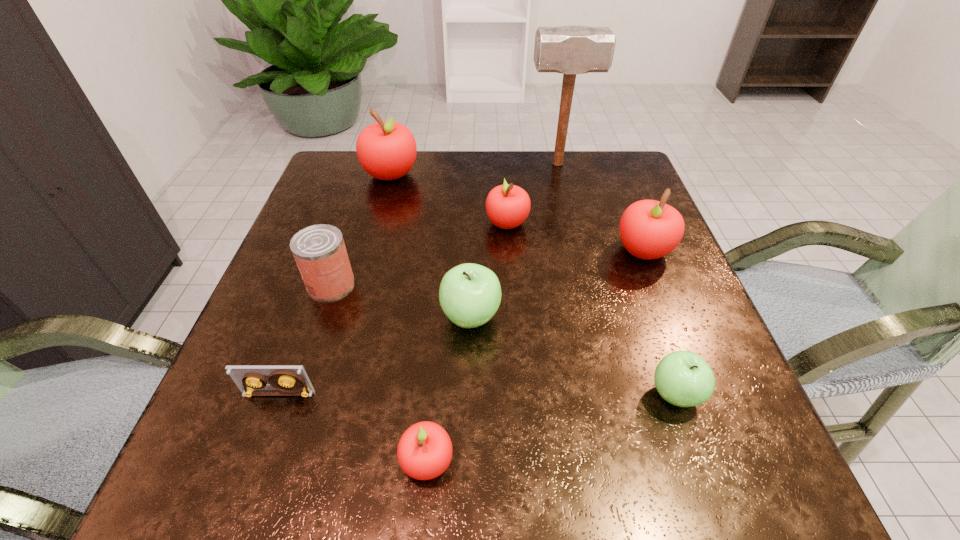
You are a GUI agent. You are given a task and a screenshot of the screen. Output one action in this format:
    pyautogui.click(x=<x>, y=<y>)
    Task: Click on the can located in the left edge section of the desktop
    The width and height of the screenshot is (960, 540).
    Given the screenshot: What is the action you would take?
    pyautogui.click(x=319, y=250)

In order to click on videotape that is at the left edge in this screenshot , I will do `click(290, 379)`.

The height and width of the screenshot is (540, 960). Find the location of `mallet that is at the right edge`. mallet that is at the right edge is located at coordinates (571, 49).

Identify the location of object positioned at the far left corner. This screenshot has width=960, height=540. (386, 150).

The height and width of the screenshot is (540, 960). What are the coordinates of `object that is at the far right corner` in the screenshot? It's located at (571, 49).

You are a GUI agent. You are given a task and a screenshot of the screen. Output one action in this format:
    pyautogui.click(x=<x>, y=<y>)
    Task: Click on the free location at the far edge
    This screenshot has width=960, height=540.
    Given the screenshot: What is the action you would take?
    pyautogui.click(x=532, y=158)

I want to click on vacant space at the left edge of the desktop, so click(x=343, y=305).

This screenshot has height=540, width=960. I want to click on vacant space at the right edge, so click(x=675, y=266).

Where is `vacant space at the far left corner of the desktop`? The width and height of the screenshot is (960, 540). vacant space at the far left corner of the desktop is located at coordinates (317, 199).

Locate an element on the screen. The height and width of the screenshot is (540, 960). vacant area that lies between the can and the biggest red apple is located at coordinates (361, 229).